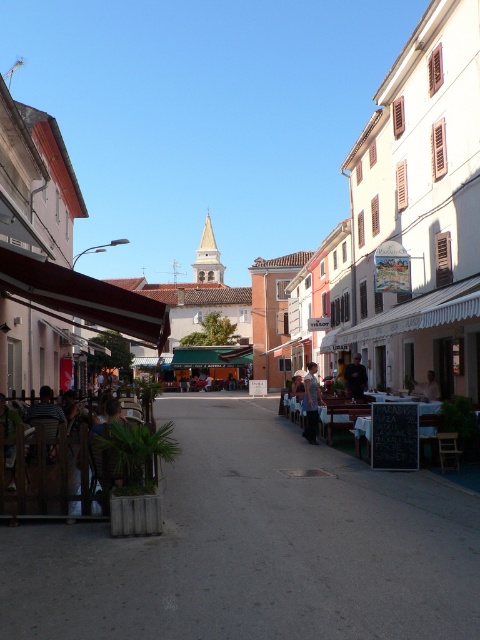
Is light brown leather jacket at center to the right of white fabric chair at center from the viewer's perspective?

No, light brown leather jacket at center is not to the right of white fabric chair at center.

Can you confirm if light brown leather jacket at center is bigger than white fabric chair at center?

Yes.

Is point (304, 387) more distant than point (425, 381)?

No, (304, 387) is in front of (425, 381).

In order to click on light brown leather jacket at center in this screenshot , I will do `click(311, 403)`.

Between concrete pavement at center and black chalkboard at center, which one has more height?

Standing taller between the two is concrete pavement at center.

Between concrete pavement at center and black chalkboard at center, which one appears on the left side from the viewer's perspective?

Positioned to the left is concrete pavement at center.

Does point (195, 547) lie in front of point (360, 428)?

Yes, point (195, 547) is closer to viewer.

Where is `concrete pavement at center`? This screenshot has width=480, height=640. concrete pavement at center is located at coordinates (255, 547).

How far apart are black chalkboard at center and light brown leather jacket at center?

black chalkboard at center is 11.34 feet from light brown leather jacket at center.

Does black chalkboard at center appear over light brown leather jacket at center?

Correct, black chalkboard at center is located above light brown leather jacket at center.

Is point (422, 433) more distant than point (315, 440)?

No, it is not.

The height and width of the screenshot is (640, 480). I want to click on black chalkboard at center, so click(x=361, y=436).